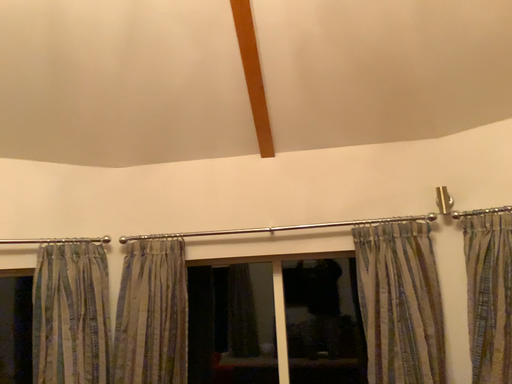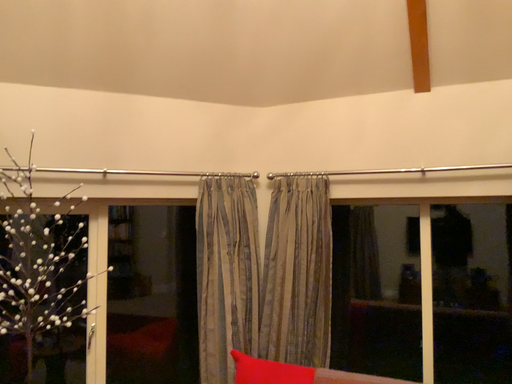
Question: How did the camera likely rotate when shooting the video?

Choices:
 (A) rotated upward
 (B) rotated downward

Answer: (B)